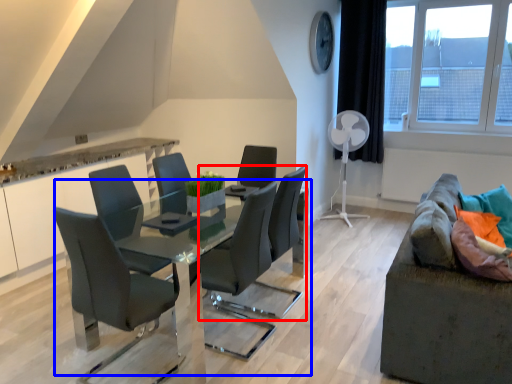
Question: Which object appears closest to the camera in this image, chair (highlighted by a red box) or table (highlighted by a blue box)?

Choices:
 (A) chair
 (B) table

Answer: (B)